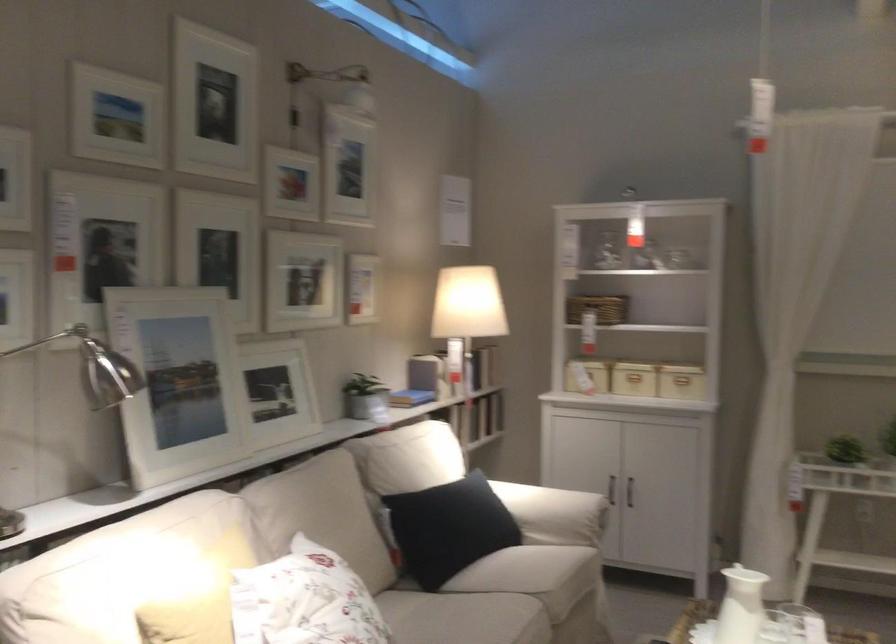
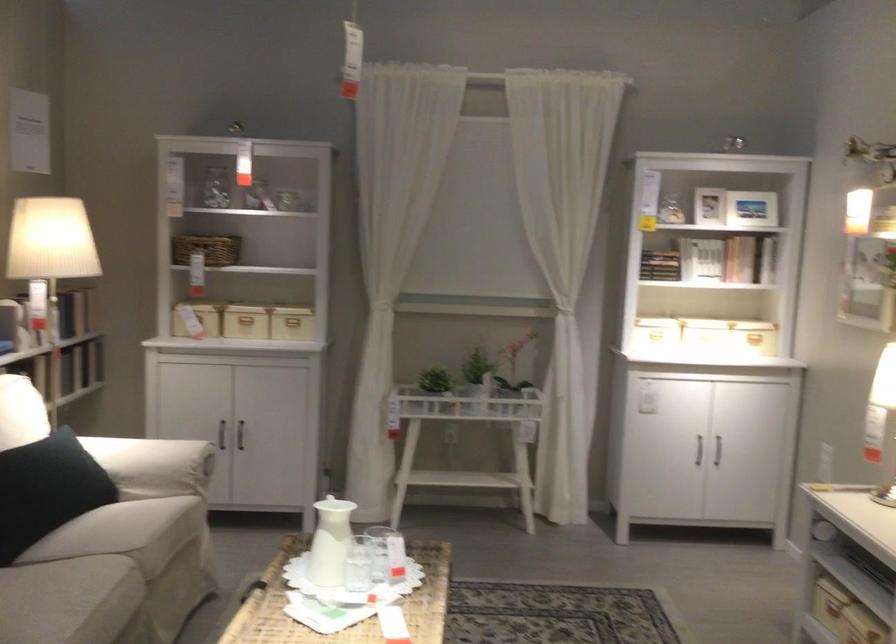
Where in the second image is the point corresponding to pixel 683 370 from the first image?

(291, 321)